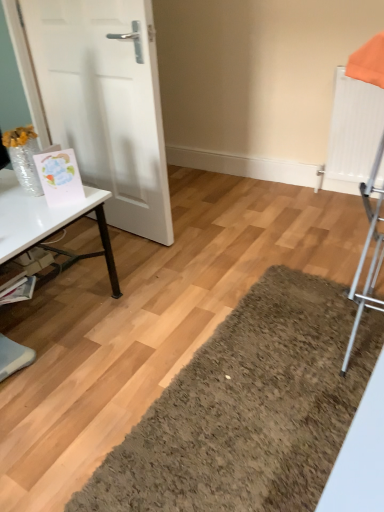
Question: Would you say white glossy table at left contains white matte door at left?

Choices:
 (A) yes
 (B) no

Answer: (B)

Question: Is white glossy table at left closer to the viewer compared to white matte door at left?

Choices:
 (A) no
 (B) yes

Answer: (B)

Question: Can you confirm if white glossy table at left is wider than white matte door at left?

Choices:
 (A) no
 (B) yes

Answer: (B)

Question: Is white glossy table at left in contact with white matte door at left?

Choices:
 (A) yes
 (B) no

Answer: (B)

Question: Is white glossy table at left positioned far away from white matte door at left?

Choices:
 (A) yes
 (B) no

Answer: (B)

Question: From the image's perspective, is white glossy table at left located beneath white matte door at left?

Choices:
 (A) no
 (B) yes

Answer: (B)

Question: Considering the relative sizes of white matte door at left and white glossy table at left in the image provided, is white matte door at left thinner than white glossy table at left?

Choices:
 (A) no
 (B) yes

Answer: (B)

Question: Does white matte door at left appear on the left side of white glossy table at left?

Choices:
 (A) no
 (B) yes

Answer: (A)

Question: Is the depth of white matte door at left greater than that of white glossy table at left?

Choices:
 (A) yes
 (B) no

Answer: (A)

Question: From a real-world perspective, is white matte door at left below white glossy table at left?

Choices:
 (A) no
 (B) yes

Answer: (A)

Question: Could white glossy table at left be considered to be inside white matte door at left?

Choices:
 (A) yes
 (B) no

Answer: (B)

Question: Considering the relative sizes of white matte door at left and white glossy table at left in the image provided, is white matte door at left smaller than white glossy table at left?

Choices:
 (A) no
 (B) yes

Answer: (B)

Question: Which is correct: white glossy table at left is inside white matte door at left, or outside of it?

Choices:
 (A) inside
 (B) outside

Answer: (B)